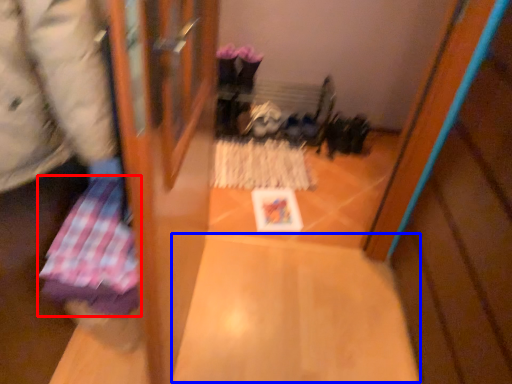
Question: Which of the following is the farthest to the observer, wrapping paper (highlighted by a red box) or wide (highlighted by a blue box)?

Choices:
 (A) wrapping paper
 (B) wide

Answer: (B)